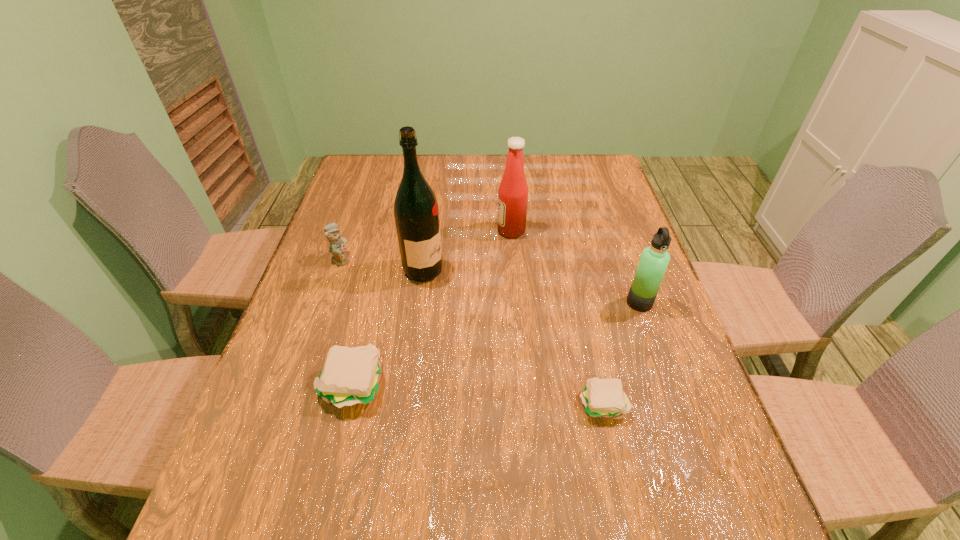
At what (x,y) coordinates should I click in order to perform the action: click on vacant space in between the fifth shortest object and the third tallest object. Please return your answer as a coordinate pair (x, y). Looking at the image, I should click on (575, 267).

The image size is (960, 540). I want to click on unoccupied position between the teddy bear and the liquor, so click(x=382, y=265).

Identify the location of vacant space in between the liquor and the shortest object. (513, 337).

This screenshot has width=960, height=540. Identify the location of empty space between the thermos bottle and the second object from right to left. (621, 353).

Where is `empty space that is in between the teddy bear and the right patty`? The image size is (960, 540). empty space that is in between the teddy bear and the right patty is located at coordinates (471, 331).

Locate an element on the screen. The image size is (960, 540). empty location between the condiment and the liquor is located at coordinates (468, 251).

The width and height of the screenshot is (960, 540). I want to click on unoccupied position between the taller patty and the rightmost object, so click(x=496, y=344).

Identify the location of free point between the second tallest object and the liquor. The image size is (960, 540). (468, 251).

Image resolution: width=960 pixels, height=540 pixels. I want to click on unoccupied area between the leftmost object and the shortest object, so click(471, 331).

Choose which object is the fourth nearest neighbor to the tallest object. Please provide its 2D coordinates. Your answer should be formatted as a tuple, i.e. [(x, y)], where the tuple contains the x and y coordinates of a point satisfying the conditions above.

[(604, 398)]